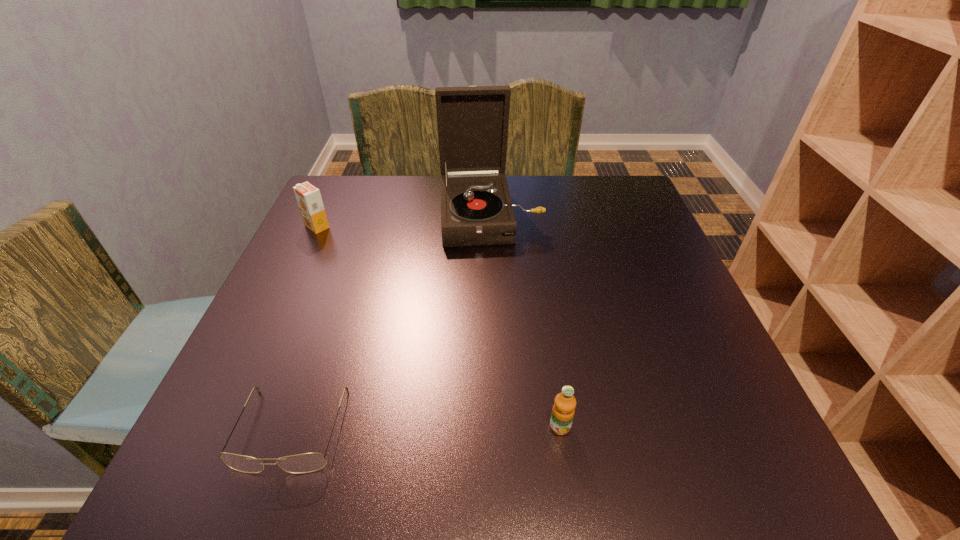
Identify the location of vacant area at the near right corner of the desktop. (724, 493).

The image size is (960, 540). In order to click on blank region between the third tallest object and the tallest object in this screenshot , I will do `click(525, 321)`.

Find the location of a particular element. The height and width of the screenshot is (540, 960). unoccupied area between the spectacles and the nearer orange juice is located at coordinates (425, 428).

Find the location of a particular element. blank region between the third tallest object and the phonograph record is located at coordinates (525, 321).

Where is `empty space between the tallest object and the second tallest object`? This screenshot has width=960, height=540. empty space between the tallest object and the second tallest object is located at coordinates (403, 221).

Locate an element on the screen. The width and height of the screenshot is (960, 540). free spot between the right orange juice and the tallest object is located at coordinates (525, 321).

Locate an element on the screen. vacant region between the tallest object and the right orange juice is located at coordinates (525, 321).

This screenshot has height=540, width=960. I want to click on unoccupied position between the third tallest object and the tallest object, so click(525, 321).

You are a GUI agent. You are given a task and a screenshot of the screen. Output one action in this format:
    pyautogui.click(x=<x>, y=<y>)
    Task: Click on the free space that is in between the nearer orange juice and the shortest object
    
    Given the screenshot: What is the action you would take?
    click(425, 428)

At what (x,y) coordinates should I click in order to perform the action: click on unoccupied position between the shortest object and the farther orange juice. Please return your answer as a coordinate pair (x, y). This screenshot has height=540, width=960. Looking at the image, I should click on (304, 328).